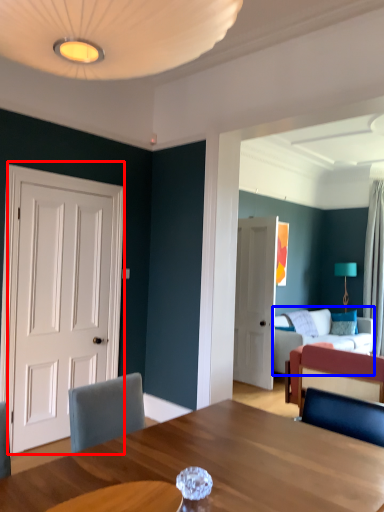
Question: Which of the following is the farthest to the observer, door (highlighted by a red box) or studio couch (highlighted by a blue box)?

Choices:
 (A) door
 (B) studio couch

Answer: (B)